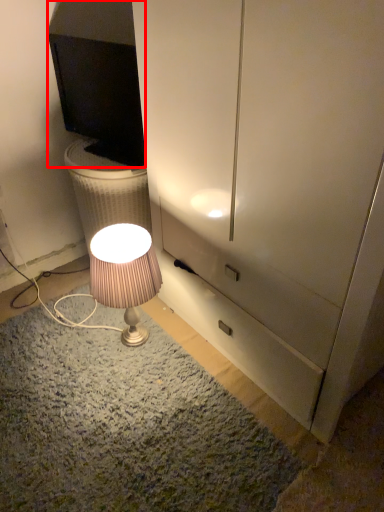
Question: In this image, where is television (annotated by the red box) located relative to lamp?

Choices:
 (A) left
 (B) right

Answer: (A)